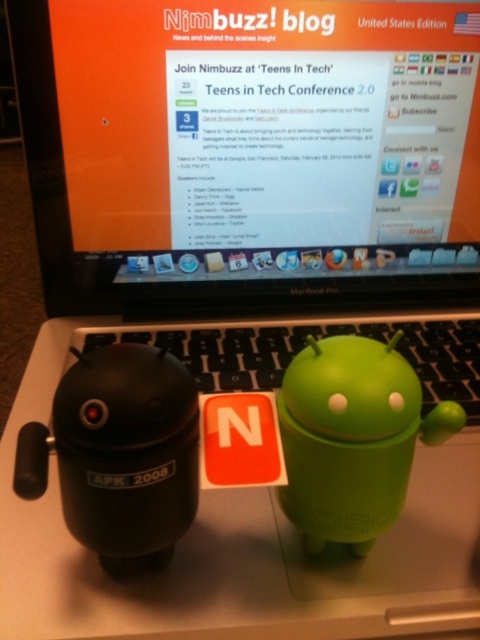
You are organizing a tech event and need to set up a laptop on a table. Based on the scene, can you place the matte black laptop at center on top of the matte plastic table at center without moving any other objects?

The matte plastic table at center is behind the matte black laptop at center, so the laptop is already placed on the table. Therefore, you don not need to move it.

You are a delivery robot trying to place a small package on the table between the black Android figurine labeled APK 200 and the white Android figurine labeled APK 201. The package must be placed exactly at the point marked by the coordinates point (244, 531). Can you confirm if this point is on the matte plastic table at center where the figurines are located?

Yes, the point (244, 531) is on the matte plastic table at center where the figurines are located, so the package can be placed there safely.

You are organizing a tech event and need to set up a laptop on a table. Based on the scene described, can the matte black laptop at center be placed on the matte plastic table at center without any issues?

The matte black laptop at center is already located above the matte plastic table at center, so it can be placed there without any issues.